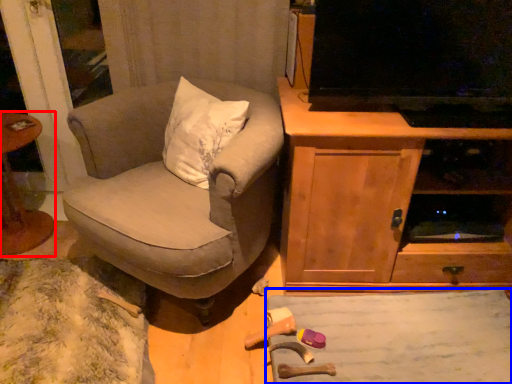
Question: Which of the following is the closest to the observer, table (highlighted by a red box) or plain (highlighted by a blue box)?

Choices:
 (A) table
 (B) plain

Answer: (B)